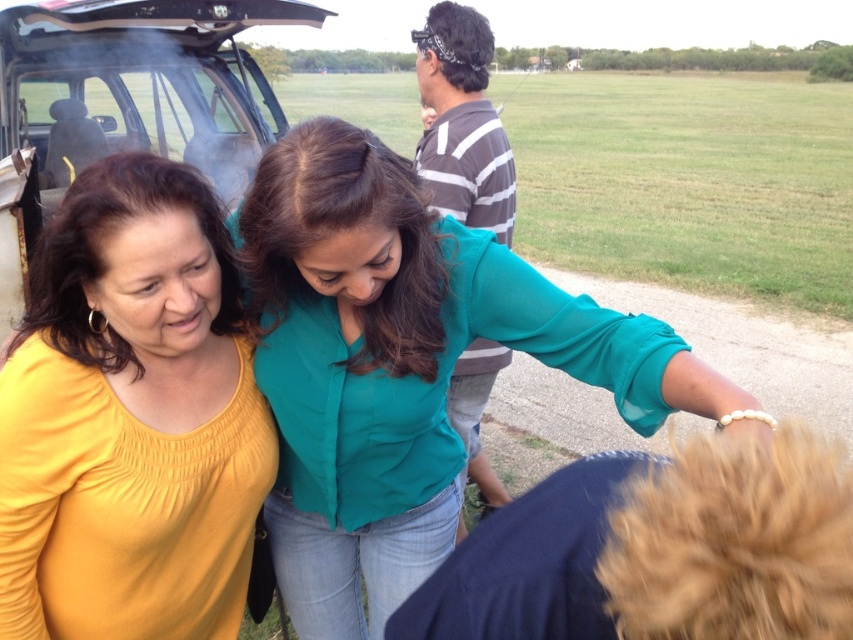
You are standing in the middle of the grassy field and want to walk towards both the point at coordinates (42,161) and the point at coordinates (459,534). Which point will you reach first?

You will reach point (42,161) first because it is closer to you than point (459,534).

You are standing at the point marked as point (4, 608) and want to walk to the point marked as point (489, 476). Which direction should you move relative to your current position?

You should move towards the upper left direction because point (489, 476) is located in that direction from point (4, 608).